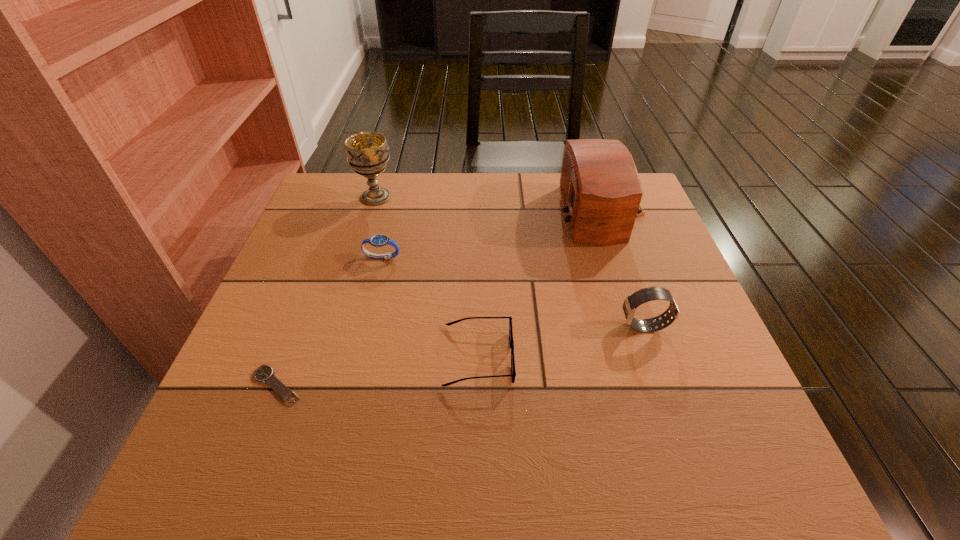
You are a GUI agent. You are given a task and a screenshot of the screen. Output one action in this format:
    pyautogui.click(x=<x>, y=<y>)
    Task: Click on the unoccupied area between the chalice and the tallest watch
    Image resolution: width=960 pixels, height=540 pixels.
    Given the screenshot: What is the action you would take?
    pyautogui.click(x=510, y=262)

Locate an element on the screen. empty space between the radio receiver and the second nearest watch is located at coordinates (x=623, y=269).

Where is `free space that is in between the rightmost watch and the radio receiver`? The height and width of the screenshot is (540, 960). free space that is in between the rightmost watch and the radio receiver is located at coordinates (623, 269).

Find the location of a particular element. free space between the third object from right to left and the shortest object is located at coordinates (377, 371).

Identify the location of vacant area that lies between the chalice and the shortest object. (326, 291).

Point out which object is positioned as the nearest to the radio receiver. Please provide its 2D coordinates. Your answer should be formatted as a tuple, i.e. [(x, y)], where the tuple contains the x and y coordinates of a point satisfying the conditions above.

[(644, 295)]

Locate which object ranks third in proximity to the chalice. Please provide its 2D coordinates. Your answer should be formatted as a tuple, i.e. [(x, y)], where the tuple contains the x and y coordinates of a point satisfying the conditions above.

[(513, 373)]

Where is `watch that is the closest to the leftmost watch`? watch that is the closest to the leftmost watch is located at coordinates (380, 240).

Point out which watch is positioned as the nearest to the fifth tallest object. Please provide its 2D coordinates. Your answer should be formatted as a tuple, i.e. [(x, y)], where the tuple contains the x and y coordinates of a point satisfying the conditions above.

[(644, 295)]

Find the location of a particular element. The width and height of the screenshot is (960, 540). free space that satisfies the following two spatial constraints: 1. on the front side of the chalice; 2. on the right side of the third farthest object is located at coordinates (358, 258).